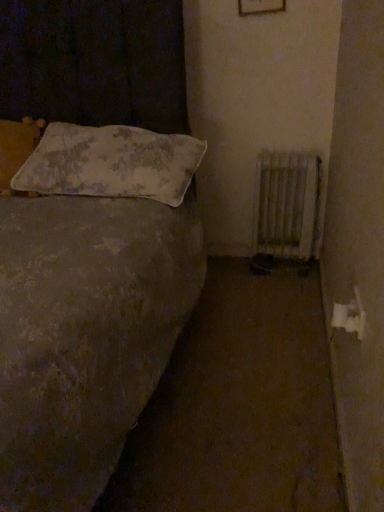
You are a GUI agent. You are given a task and a screenshot of the screen. Output one action in this format:
    pyautogui.click(x=<x>, y=<y>)
    Task: Click on the wooden frame at upper center
    Image resolution: width=384 pixels, height=512 pixels.
    Given the screenshot: What is the action you would take?
    pyautogui.click(x=260, y=7)

Where is `fluffy white pillow at upper left, which ranks as the 1th pillow in left-to-right order`? fluffy white pillow at upper left, which ranks as the 1th pillow in left-to-right order is located at coordinates (17, 147).

Describe the element at coordinates (111, 163) in the screenshot. This screenshot has width=384, height=512. I see `fluffy white pillow at upper left, positioned as the 1th pillow in right-to-left order` at that location.

The image size is (384, 512). I want to click on white metallic radiator at lower right, so click(286, 205).

The height and width of the screenshot is (512, 384). What are the coordinates of `radiator behind the fluffy white pillow at upper left, which ranks as the 2th pillow in left-to-right order` in the screenshot? It's located at (286, 205).

Considering the relative sizes of fluffy white pillow at upper left, positioned as the 1th pillow in right-to-left order, and white metallic radiator at lower right in the image provided, is fluffy white pillow at upper left, positioned as the 1th pillow in right-to-left order, wider than white metallic radiator at lower right?

Yes, fluffy white pillow at upper left, positioned as the 1th pillow in right-to-left order, is wider than white metallic radiator at lower right.

In the scene shown: From the image's perspective, which one is positioned lower, fluffy white pillow at upper left, positioned as the 1th pillow in right-to-left order, or white metallic radiator at lower right?

white metallic radiator at lower right.

Is fluffy white pillow at upper left, positioned as the 1th pillow in right-to-left order, in contact with white metallic radiator at lower right?

fluffy white pillow at upper left, positioned as the 1th pillow in right-to-left order, is not next to white metallic radiator at lower right, and they're not touching.

Does point (7, 184) come farther from viewer compared to point (52, 192)?

Yes, it is behind point (52, 192).

Which object is closer to the camera, fluffy white pillow at upper left, which ranks as the 1th pillow in left-to-right order, or fluffy white pillow at upper left, positioned as the 1th pillow in right-to-left order?

fluffy white pillow at upper left, positioned as the 1th pillow in right-to-left order.

From the image's perspective, is fluffy white pillow at upper left, which appears as the second pillow when viewed from the right, beneath fluffy white pillow at upper left, which ranks as the 2th pillow in left-to-right order?

Actually, fluffy white pillow at upper left, which appears as the second pillow when viewed from the right, appears above fluffy white pillow at upper left, which ranks as the 2th pillow in left-to-right order, in the image.

Considering the relative positions of fluffy white pillow at upper left, which appears as the second pillow when viewed from the right, and fluffy white pillow at upper left, which ranks as the 2th pillow in left-to-right order, in the image provided, is fluffy white pillow at upper left, which appears as the second pillow when viewed from the right, to the left of fluffy white pillow at upper left, which ranks as the 2th pillow in left-to-right order, from the viewer's perspective?

Yes.

Identify the location of the 2nd pillow in front of the wooden frame at upper center, starting your count from the anchor. pyautogui.click(x=111, y=163).

Which is closer, (x=251, y=3) or (x=148, y=165)?

Positioned in front is point (x=148, y=165).

Can you confirm if wooden frame at upper center is bigger than fluffy white pillow at upper left, which ranks as the 2th pillow in left-to-right order?

Actually, wooden frame at upper center might be smaller than fluffy white pillow at upper left, which ranks as the 2th pillow in left-to-right order.

From the image's perspective, who appears lower, wooden frame at upper center or fluffy white pillow at upper left, which ranks as the 2th pillow in left-to-right order?

fluffy white pillow at upper left, which ranks as the 2th pillow in left-to-right order, from the image's perspective.

Based on the photo, is fluffy white pillow at upper left, positioned as the 1th pillow in right-to-left order, facing towards fluffy white pillow at upper left, which appears as the second pillow when viewed from the right?

No, fluffy white pillow at upper left, positioned as the 1th pillow in right-to-left order, is not aimed at fluffy white pillow at upper left, which appears as the second pillow when viewed from the right.

Is fluffy white pillow at upper left, positioned as the 1th pillow in right-to-left order, further to camera compared to fluffy white pillow at upper left, which ranks as the 1th pillow in left-to-right order?

No, fluffy white pillow at upper left, positioned as the 1th pillow in right-to-left order, is in front of fluffy white pillow at upper left, which ranks as the 1th pillow in left-to-right order.

Identify the location of pillow above the fluffy white pillow at upper left, positioned as the 1th pillow in right-to-left order (from a real-world perspective). This screenshot has width=384, height=512. (17, 147).

Measure the distance between fluffy white pillow at upper left, positioned as the 1th pillow in right-to-left order, and fluffy white pillow at upper left, which appears as the second pillow when viewed from the right.

fluffy white pillow at upper left, positioned as the 1th pillow in right-to-left order, and fluffy white pillow at upper left, which appears as the second pillow when viewed from the right, are 12.09 inches apart from each other.

From the image's perspective, is fluffy white pillow at upper left, which ranks as the 1th pillow in left-to-right order, above or below wooden frame at upper center?

From the image's perspective, fluffy white pillow at upper left, which ranks as the 1th pillow in left-to-right order, appears below wooden frame at upper center.

Who is bigger, fluffy white pillow at upper left, which ranks as the 1th pillow in left-to-right order, or wooden frame at upper center?

Bigger between the two is fluffy white pillow at upper left, which ranks as the 1th pillow in left-to-right order.

What's the angular difference between fluffy white pillow at upper left, which appears as the second pillow when viewed from the right, and wooden frame at upper center's facing directions?

There is a 1.69-degree angle between the facing directions of fluffy white pillow at upper left, which appears as the second pillow when viewed from the right, and wooden frame at upper center.

Are fluffy white pillow at upper left, which ranks as the 1th pillow in left-to-right order, and wooden frame at upper center making contact?

No, fluffy white pillow at upper left, which ranks as the 1th pillow in left-to-right order, is not touching wooden frame at upper center.

Can you tell me how much fluffy white pillow at upper left, which appears as the second pillow when viewed from the right, and white metallic radiator at lower right differ in facing direction?

They differ by 0.965 degrees in their facing directions.

This screenshot has height=512, width=384. What are the coordinates of `radiator below the fluffy white pillow at upper left, which appears as the second pillow when viewed from the right (from a real-world perspective)` in the screenshot? It's located at (286, 205).

Is fluffy white pillow at upper left, which ranks as the 1th pillow in left-to-right order, bigger than white metallic radiator at lower right?

Yes, fluffy white pillow at upper left, which ranks as the 1th pillow in left-to-right order, is bigger than white metallic radiator at lower right.

Find the location of a particular element. picture frame behind the fluffy white pillow at upper left, positioned as the 1th pillow in right-to-left order is located at coordinates (260, 7).

Does fluffy white pillow at upper left, positioned as the 1th pillow in right-to-left order, contain wooden frame at upper center?

That's incorrect, wooden frame at upper center is not inside fluffy white pillow at upper left, positioned as the 1th pillow in right-to-left order.

Is fluffy white pillow at upper left, positioned as the 1th pillow in right-to-left order, thinner than wooden frame at upper center?

Incorrect, the width of fluffy white pillow at upper left, positioned as the 1th pillow in right-to-left order, is not less than that of wooden frame at upper center.

What are the coordinates of `radiator below the fluffy white pillow at upper left, which ranks as the 2th pillow in left-to-right order (from a real-world perspective)` in the screenshot? It's located at (286, 205).

Where is `pillow on the right of fluffy white pillow at upper left, which ranks as the 1th pillow in left-to-right order`? Image resolution: width=384 pixels, height=512 pixels. pillow on the right of fluffy white pillow at upper left, which ranks as the 1th pillow in left-to-right order is located at coordinates (111, 163).

Estimate the real-world distances between objects in this image. Which object is further from fluffy white pillow at upper left, which ranks as the 2th pillow in left-to-right order, white metallic radiator at lower right or wooden frame at upper center?

wooden frame at upper center is positioned further to the anchor fluffy white pillow at upper left, which ranks as the 2th pillow in left-to-right order.

Based on their spatial positions, is wooden frame at upper center or white metallic radiator at lower right closer to fluffy white pillow at upper left, which ranks as the 2th pillow in left-to-right order?

white metallic radiator at lower right is positioned closer to the anchor fluffy white pillow at upper left, which ranks as the 2th pillow in left-to-right order.

From the image, which object appears to be nearer to fluffy white pillow at upper left, which appears as the second pillow when viewed from the right, white metallic radiator at lower right or wooden frame at upper center?

wooden frame at upper center lies closer to fluffy white pillow at upper left, which appears as the second pillow when viewed from the right, than the other object.

When comparing their distances from white metallic radiator at lower right, does fluffy white pillow at upper left, which appears as the second pillow when viewed from the right, or fluffy white pillow at upper left, positioned as the 1th pillow in right-to-left order, seem further?

fluffy white pillow at upper left, which appears as the second pillow when viewed from the right, lies further to white metallic radiator at lower right than the other object.

Which object lies nearer to the anchor point fluffy white pillow at upper left, which appears as the second pillow when viewed from the right, wooden frame at upper center or white metallic radiator at lower right?

The object closer to fluffy white pillow at upper left, which appears as the second pillow when viewed from the right, is wooden frame at upper center.

Looking at the image, which one is located closer to fluffy white pillow at upper left, which ranks as the 2th pillow in left-to-right order, white metallic radiator at lower right or fluffy white pillow at upper left, which ranks as the 1th pillow in left-to-right order?

fluffy white pillow at upper left, which ranks as the 1th pillow in left-to-right order, lies closer to fluffy white pillow at upper left, which ranks as the 2th pillow in left-to-right order, than the other object.

From the image, which object appears to be nearer to fluffy white pillow at upper left, positioned as the 1th pillow in right-to-left order, fluffy white pillow at upper left, which ranks as the 1th pillow in left-to-right order, or white metallic radiator at lower right?

The object closer to fluffy white pillow at upper left, positioned as the 1th pillow in right-to-left order, is fluffy white pillow at upper left, which ranks as the 1th pillow in left-to-right order.

In the scene shown: When comparing their distances from white metallic radiator at lower right, does fluffy white pillow at upper left, which ranks as the 2th pillow in left-to-right order, or wooden frame at upper center seem further?

wooden frame at upper center.

What are the coordinates of `picture frame situated between fluffy white pillow at upper left, which appears as the second pillow when viewed from the right, and white metallic radiator at lower right from left to right` in the screenshot? It's located at (260, 7).

At what (x,y) coordinates should I click in order to perform the action: click on pillow located between fluffy white pillow at upper left, which appears as the second pillow when viewed from the right, and wooden frame at upper center in the left-right direction. Please return your answer as a coordinate pair (x, y). The height and width of the screenshot is (512, 384). Looking at the image, I should click on (111, 163).

Find the location of a particular element. The height and width of the screenshot is (512, 384). pillow between fluffy white pillow at upper left, which ranks as the 1th pillow in left-to-right order, and white metallic radiator at lower right from left to right is located at coordinates 111,163.